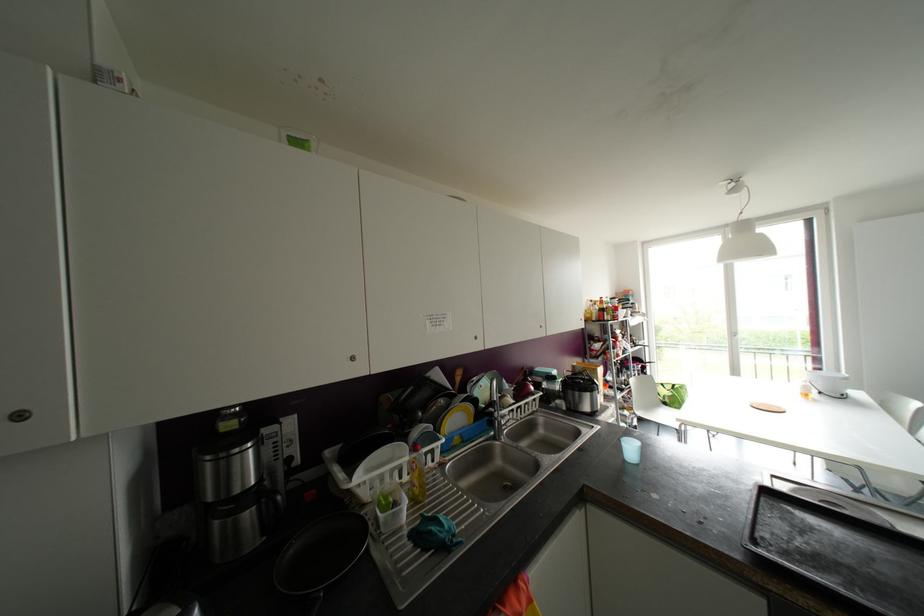
The width and height of the screenshot is (924, 616). In order to click on white bowl in this screenshot , I will do `click(829, 382)`.